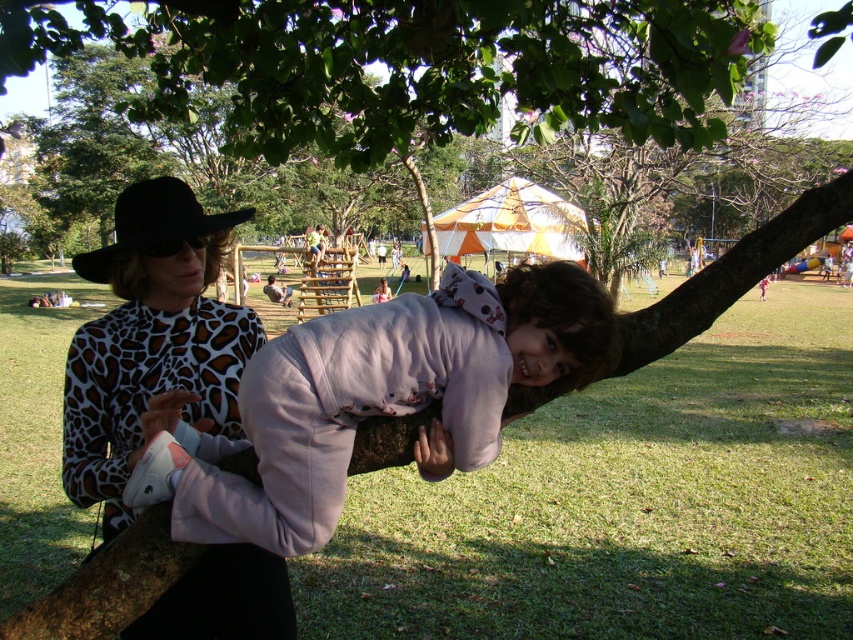
Looking at this image, can you confirm if printed fabric sweater at center is wider than brown rough tree branch at center?

Indeed, printed fabric sweater at center has a greater width compared to brown rough tree branch at center.

Can you confirm if printed fabric sweater at center is thinner than brown rough tree branch at center?

In fact, printed fabric sweater at center might be wider than brown rough tree branch at center.

This screenshot has width=853, height=640. I want to click on printed fabric sweater at center, so click(151, 340).

Where is `printed fabric sweater at center`? This screenshot has width=853, height=640. printed fabric sweater at center is located at coordinates (151, 340).

Can you confirm if pale pink fleece at center is positioned to the right of brown rough tree branch at center?

In fact, pale pink fleece at center is to the left of brown rough tree branch at center.

Measure the distance from pale pink fleece at center to brown rough tree branch at center.

pale pink fleece at center is 27.62 inches from brown rough tree branch at center.

Is point (364, 372) positioned after point (642, 355)?

No, it is not.

This screenshot has height=640, width=853. Identify the location of pale pink fleece at center. (372, 400).

Does pale pink fleece at center have a lesser height compared to printed fabric sweater at center?

Yes.

Who is more distant from viewer, (318, 486) or (204, 573)?

The point (204, 573) is behind.

Locate an element on the screen. Image resolution: width=853 pixels, height=640 pixels. pale pink fleece at center is located at coordinates (372, 400).